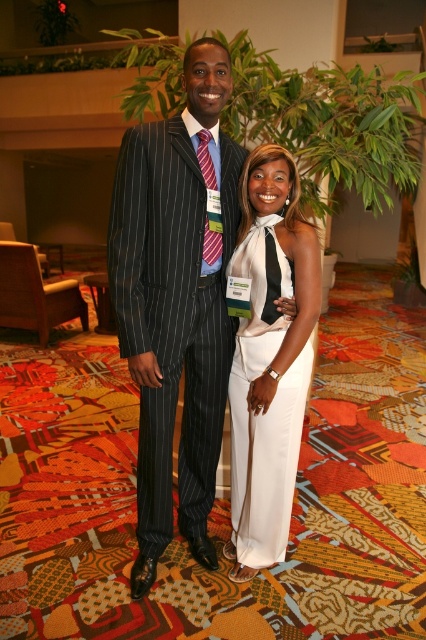
You are a photographer at the event and need to adjust the camera angle to ensure both the pinstriped suit at center and the white satin dress at center are fully visible. Based on their heights, which subject should you focus on first to avoid cropping either?

The pinstriped suit at center is taller than the white satin dress at center, so you should focus on adjusting the camera angle to accommodate the height of the pinstriped suit at center first to ensure both are fully visible.

You are a photographer trying to frame a photo of the pinstriped suit at center and the white satin dress at center. The minimum distance required between the two subjects for proper focus is 25 centimeters. Based on the scene, can you determine if they need to move farther apart to achieve the focus?

The pinstriped suit at center and white satin dress at center are 22.61 centimeters apart, which is less than the required 25 centimeters. Therefore, they need to move farther apart to achieve proper focus.